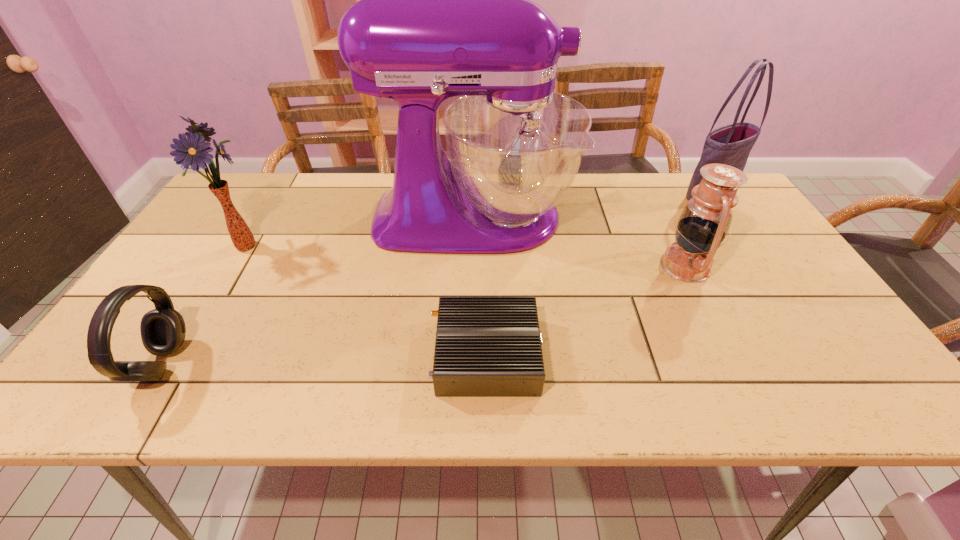
Where is `headset that is positioned at the left edge`? The image size is (960, 540). headset that is positioned at the left edge is located at coordinates (162, 329).

Find the location of a particular element. The height and width of the screenshot is (540, 960). object at the right edge is located at coordinates (731, 144).

The height and width of the screenshot is (540, 960). I want to click on object present at the near left corner, so click(162, 329).

Image resolution: width=960 pixels, height=540 pixels. What are the coordinates of `object located in the far right corner section of the desktop` in the screenshot? It's located at (731, 144).

Where is `vacant space at the far edge of the desktop`? This screenshot has width=960, height=540. vacant space at the far edge of the desktop is located at coordinates (608, 202).

At what (x,y) coordinates should I click in order to perform the action: click on vacant space at the near edge of the desktop. Please return your answer as a coordinate pair (x, y). This screenshot has height=540, width=960. Looking at the image, I should click on (777, 376).

What are the coordinates of `vacant space at the right edge of the desktop` in the screenshot? It's located at (757, 282).

In the image, there is a desktop. Identify the location of vacant space at the near left corner. This screenshot has width=960, height=540. (106, 404).

In the image, there is a desktop. Find the location of `vacant space at the far right corner`. vacant space at the far right corner is located at coordinates (686, 185).

You are a GUI agent. You are given a task and a screenshot of the screen. Output one action in this format:
    pyautogui.click(x=<x>, y=<y>)
    Task: Click on the free space between the mixer and the second shortest object
    
    Given the screenshot: What is the action you would take?
    pyautogui.click(x=318, y=291)